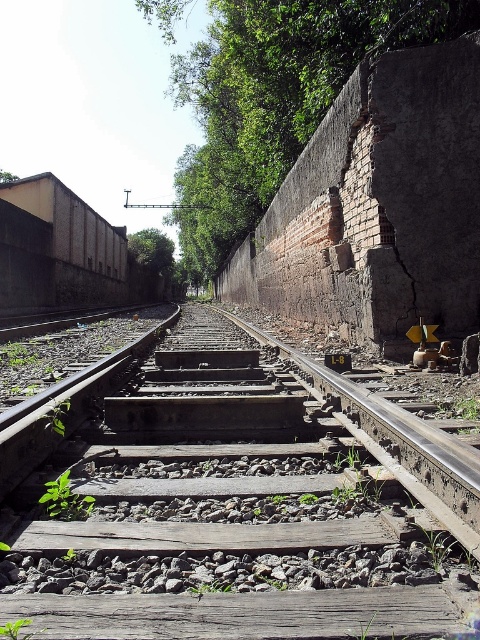
Question: Can you confirm if brown wooden train track at center is positioned to the left of green leafy tree at upper center?

Choices:
 (A) yes
 (B) no

Answer: (B)

Question: Which of the following is the farthest from the observer?

Choices:
 (A) green leafy tree at upper center
 (B) brown wooden train track at center

Answer: (A)

Question: Can you confirm if brown wooden train track at center is positioned above green leafy tree at upper center?

Choices:
 (A) yes
 (B) no

Answer: (B)

Question: Can you confirm if brown wooden train track at center is positioned to the left of green leafy tree at upper center?

Choices:
 (A) no
 (B) yes

Answer: (A)

Question: Which of the following is the closest to the observer?

Choices:
 (A) (39, 513)
 (B) (214, 198)

Answer: (A)